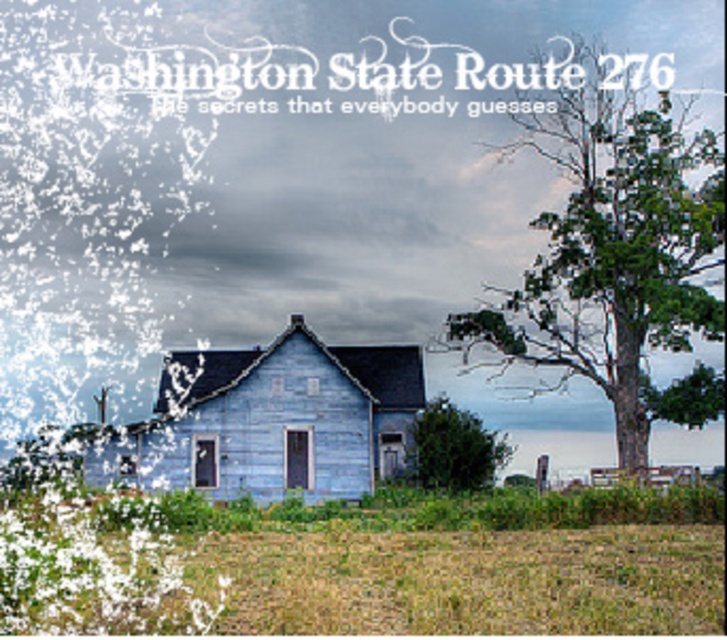
Is green textured tree at right in front of green leafy tree at center?

Yes, green textured tree at right is in front of green leafy tree at center.

Who is more forward, (x=523, y=301) or (x=459, y=483)?

Point (x=459, y=483) is in front.

Who is more distant from viewer, (670, 120) or (441, 465)?

Positioned behind is point (670, 120).

Identify the location of green textured tree at right. (614, 257).

Which of these two, green grass at lower center or green leafy tree at center, stands shorter?

green grass at lower center

Consider the image. Does green grass at lower center have a greater width compared to green leafy tree at center?

Yes, green grass at lower center is wider than green leafy tree at center.

I want to click on green grass at lower center, so [x=369, y=572].

Find the location of a particular element. Image resolution: width=727 pixels, height=640 pixels. green grass at lower center is located at coordinates (369, 572).

Does green grass at lower center appear under green textured tree at right?

Yes, green grass at lower center is below green textured tree at right.

Which is behind, point (273, 602) or point (530, 120)?

The point (530, 120) is more distant.

In order to click on green grass at lower center in this screenshot , I will do `click(369, 572)`.